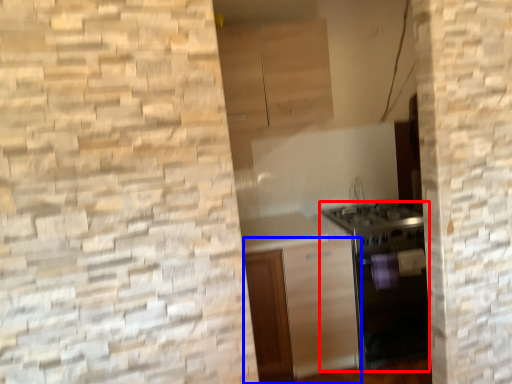
Question: Which of the following is the closest to the observer, oven (highlighted by a red box) or cabinetry (highlighted by a blue box)?

Choices:
 (A) oven
 (B) cabinetry

Answer: (B)